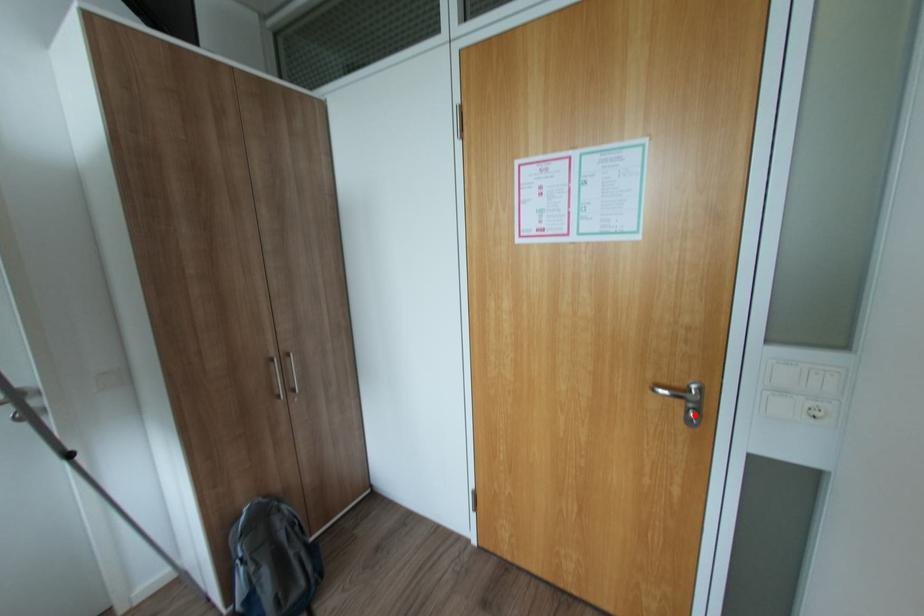
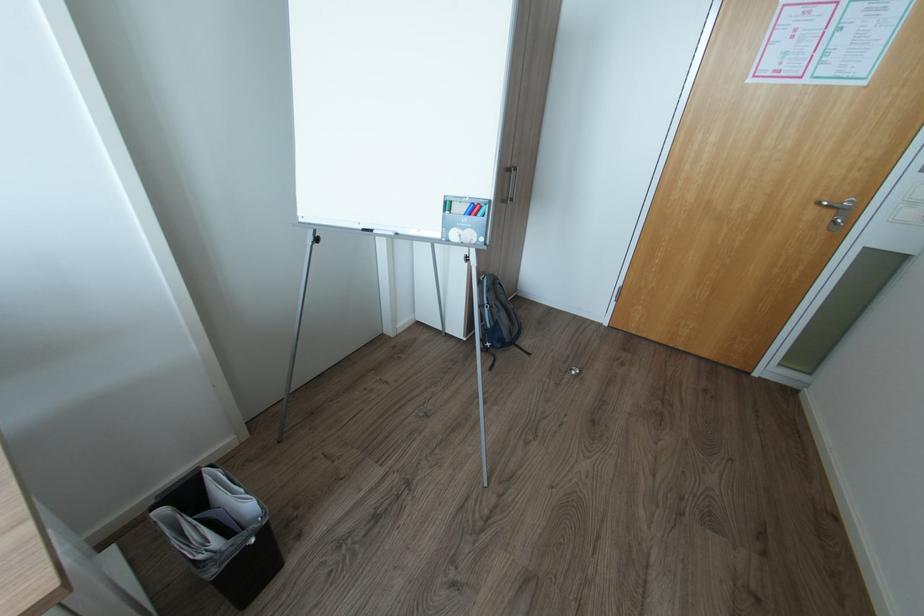
Find the pixel in the second image that matches the highlighted location in the first image.

(845, 221)